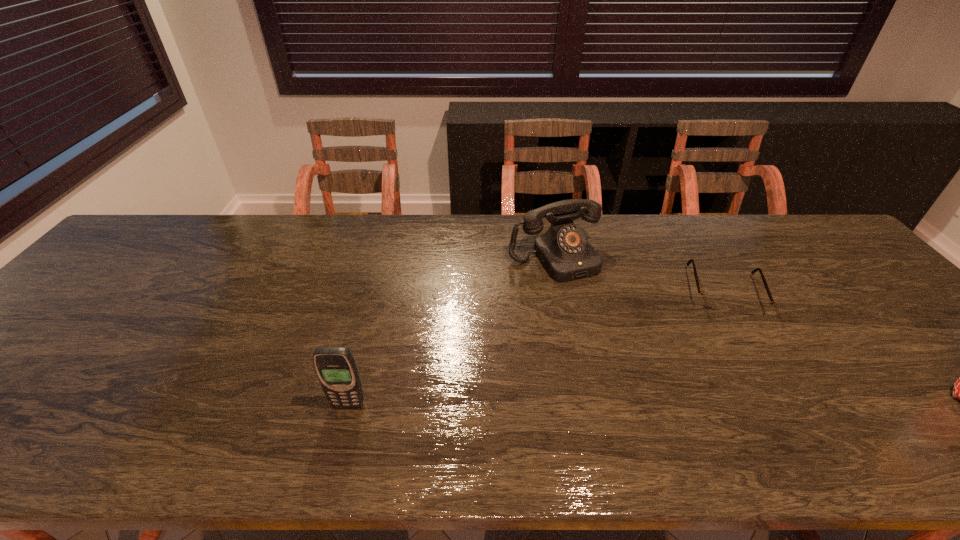
This screenshot has width=960, height=540. I want to click on the leftmost object, so click(x=336, y=368).

You are a GUI agent. You are given a task and a screenshot of the screen. Output one action in this format:
    pyautogui.click(x=<x>, y=<y>)
    Task: Click on the nearest object
    Image resolution: width=960 pixels, height=540 pixels.
    Given the screenshot: What is the action you would take?
    pyautogui.click(x=336, y=368)

Locate an element on the screen. The image size is (960, 540). the rightmost object is located at coordinates (711, 301).

The width and height of the screenshot is (960, 540). Identify the location of the shortest object. (711, 301).

At what (x,y) coordinates should I click in order to perform the action: click on the second object from left to right. Please return your answer as a coordinate pair (x, y). This screenshot has height=540, width=960. Looking at the image, I should click on (564, 251).

Find the location of a particular element. This screenshot has width=960, height=540. vacant space located 0.140m at the hinge ends of the spectacles is located at coordinates (741, 361).

The height and width of the screenshot is (540, 960). I want to click on free space located at the hinge ends of the spectacles, so click(756, 413).

The height and width of the screenshot is (540, 960). Find the location of `vacant space located 0.260m at the hinge ends of the spectacles`. vacant space located 0.260m at the hinge ends of the spectacles is located at coordinates (754, 405).

The image size is (960, 540). In order to click on vacant space located 0.230m on the dial of the second object from right to left in this screenshot , I will do `click(615, 341)`.

The width and height of the screenshot is (960, 540). What are the coordinates of `blank space located on the dial of the second object from right to left` in the screenshot? It's located at (582, 293).